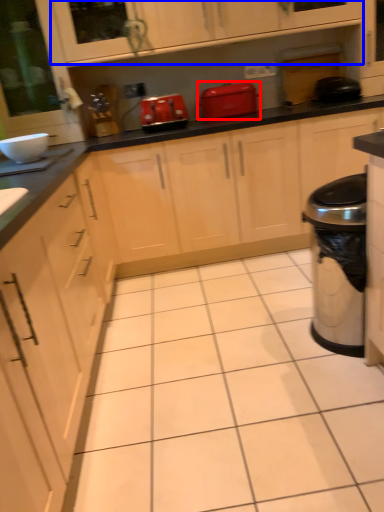
Question: Which of the following is the closest to the observer, home appliance (highlighted by a red box) or cabinetry (highlighted by a blue box)?

Choices:
 (A) home appliance
 (B) cabinetry

Answer: (B)